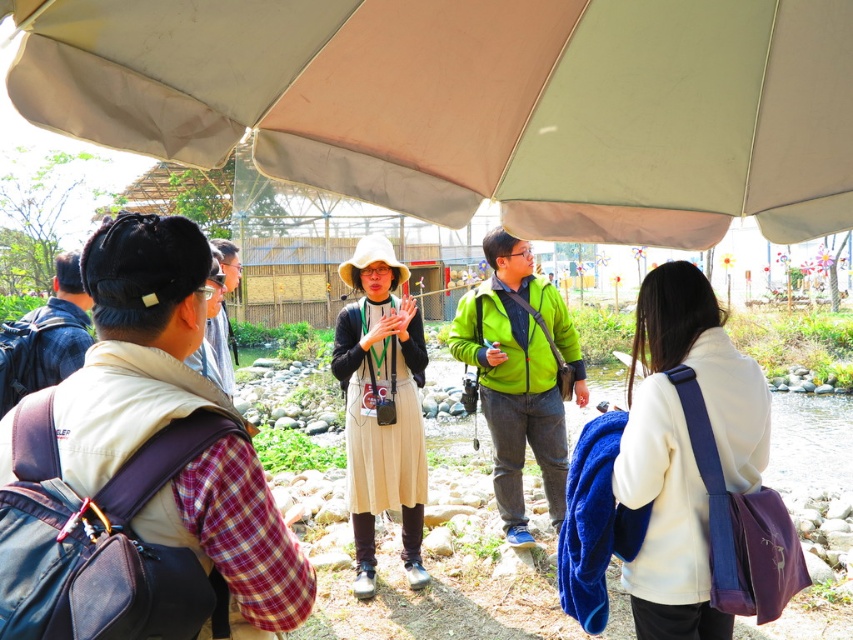
Question: Which object is the closest to the plaid fabric shirt at left?

Choices:
 (A) beige fabric canopy at upper center
 (B) beige fabric dress at center

Answer: (A)

Question: Is beige fabric canopy at upper center smaller than purple fabric bag at lower right?

Choices:
 (A) no
 (B) yes

Answer: (A)

Question: Is green fleece jacket at center behind beige fabric dress at center?

Choices:
 (A) no
 (B) yes

Answer: (A)

Question: Is plaid fabric shirt at left positioned behind beige fabric dress at center?

Choices:
 (A) yes
 (B) no

Answer: (B)

Question: Among these objects, which one is nearest to the camera?

Choices:
 (A) beige fabric dress at center
 (B) green fleece jacket at center

Answer: (B)

Question: Which of the following is the closest to the observer?

Choices:
 (A) (695, 360)
 (B) (152, 19)

Answer: (B)